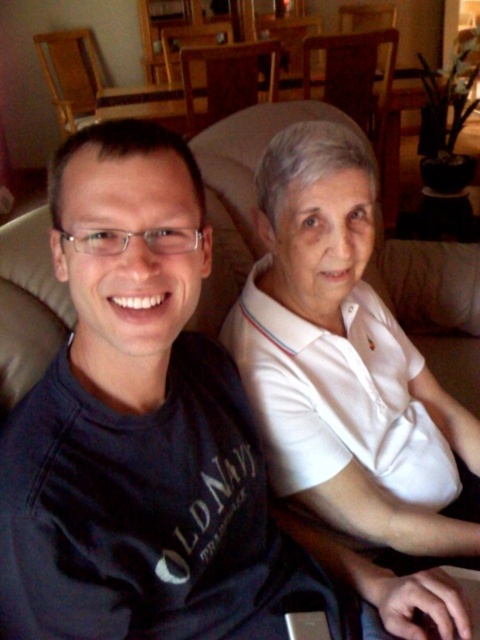
Is white smooth shirt at center above wooden chair at upper center?

No, white smooth shirt at center is not above wooden chair at upper center.

Where is `white smooth shirt at center`? The image size is (480, 640). white smooth shirt at center is located at coordinates (346, 362).

Does point (240, 314) come in front of point (137, 116)?

Yes, point (240, 314) is in front of point (137, 116).

Find the location of `white smooth shirt at center`. white smooth shirt at center is located at coordinates (346, 362).